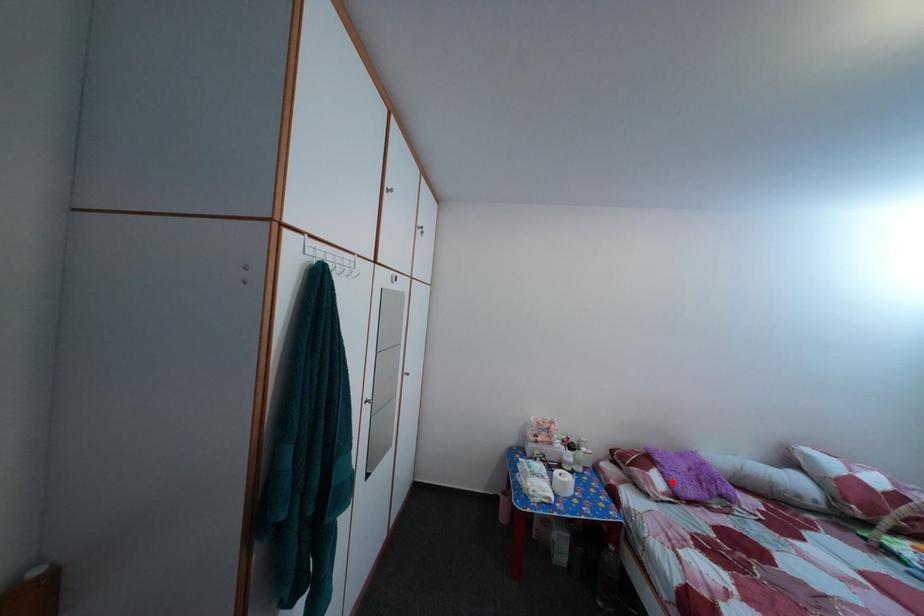
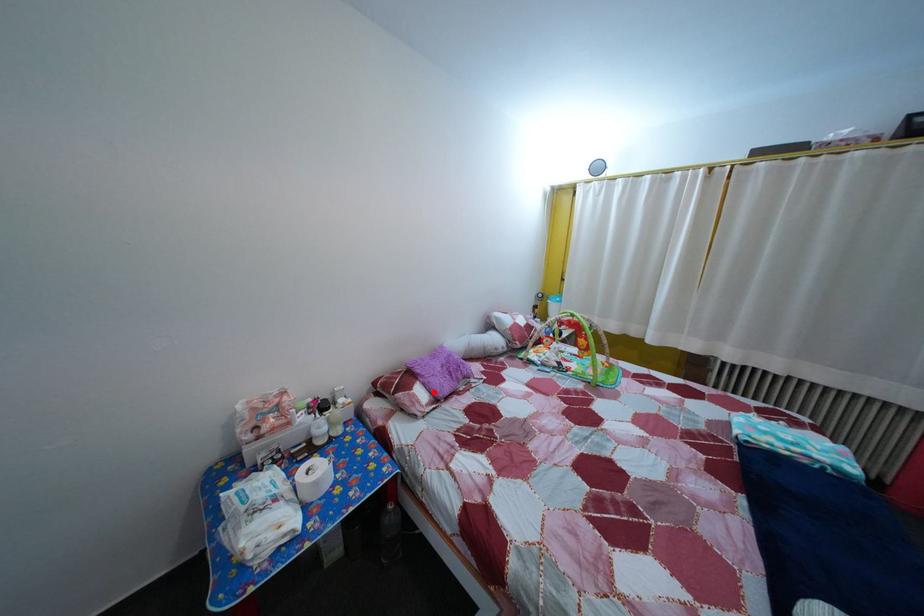
I am providing you with two images of the same scene from different viewpoints. A red point is marked on the first image and another point is marked on the second image. Is the red point in image1 aligned with the point shown in image2?

Yes